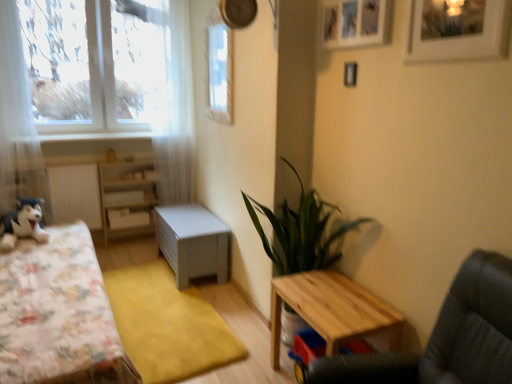
Question: Considering the positions of white sheer curtain at left, the second curtain viewed from the right, and black plush toy at left in the image, is white sheer curtain at left, the second curtain viewed from the right, wider or thinner than black plush toy at left?

Choices:
 (A) thin
 (B) wide

Answer: (A)

Question: From the image's perspective, is white sheer curtain at left, the 2th curtain when ordered from back to front, located above or below black plush toy at left?

Choices:
 (A) below
 (B) above

Answer: (B)

Question: Which is nearer to the yellow carpet at center?

Choices:
 (A) white matte drawer at center
 (B) white sheer curtain at left, positioned as the 1th curtain in left-to-right order
 (C) wooden picture frame at upper center, placed as the second picture frame when sorted from front to back
 (D) fluffy fabric bed at left
 (E) green leafy plant at center

Answer: (D)

Question: Which of these objects is positioned farthest from the fluffy fabric bed at left?

Choices:
 (A) wooden swivel chair at lower right
 (B) wooden picture frame at upper center, acting as the 1th picture frame starting from the left
 (C) white sheer curtain at left, positioned as the 1th curtain in left-to-right order
 (D) clear plastic window screen at upper center
 (E) yellow carpet at center

Answer: (B)